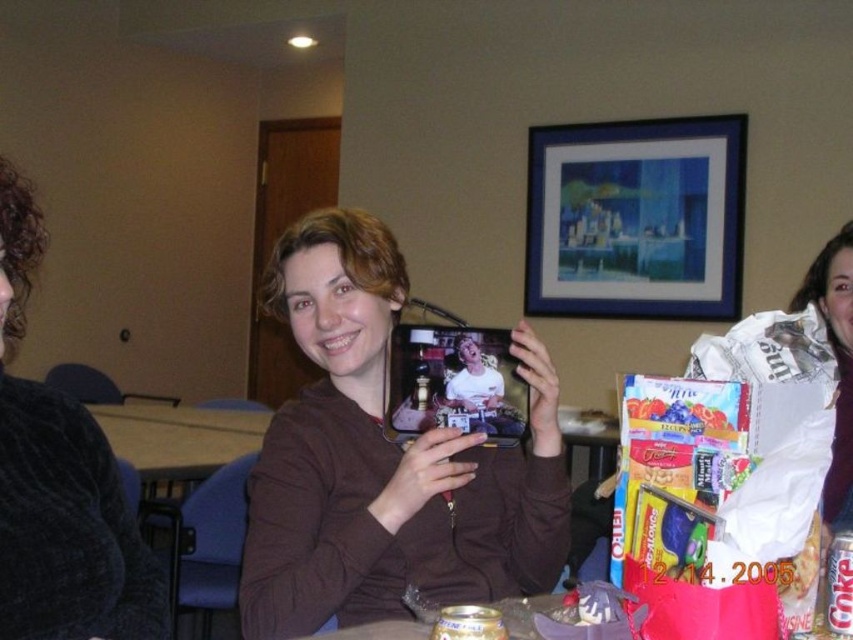
Question: Which point appears closest to the camera in this image?

Choices:
 (A) (62, 589)
 (B) (430, 385)

Answer: (A)

Question: Is blue matte picture frame at upper center closer to the viewer compared to metallic photo frame at center?

Choices:
 (A) no
 (B) yes

Answer: (A)

Question: Among these objects, which one is farthest from the camera?

Choices:
 (A) white cotton shirt at center
 (B) brown fabric table at lower left
 (C) dark brown sweater at upper center

Answer: (B)

Question: Is blue matte picture frame at upper center to the right of white cotton shirt at center from the viewer's perspective?

Choices:
 (A) no
 (B) yes

Answer: (B)

Question: Which of the following is the closest to the observer?

Choices:
 (A) white cotton shirt at center
 (B) blue matte picture frame at upper center
 (C) brown fabric table at lower left

Answer: (A)

Question: Can you confirm if blue matte picture frame at upper center is positioned below brown fabric table at lower left?

Choices:
 (A) yes
 (B) no

Answer: (B)